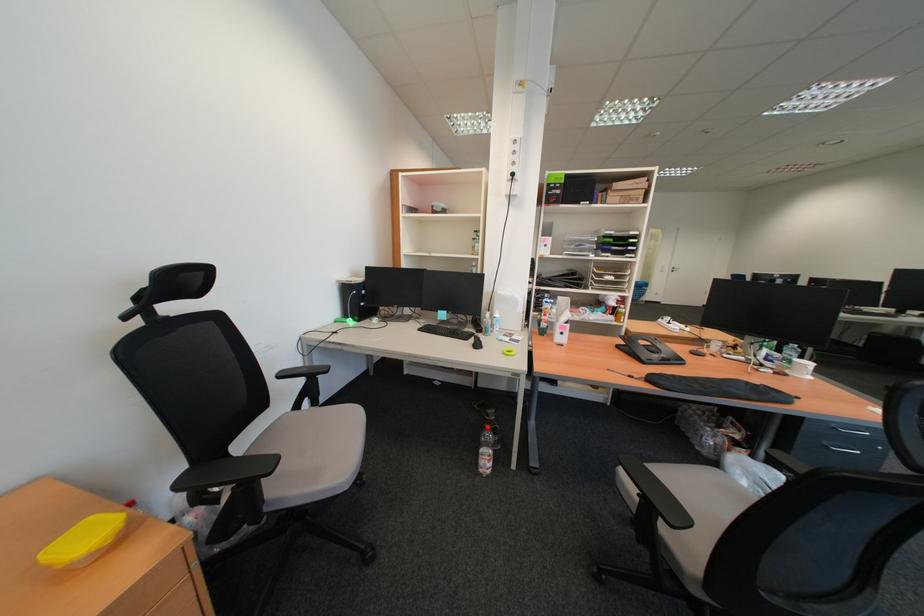
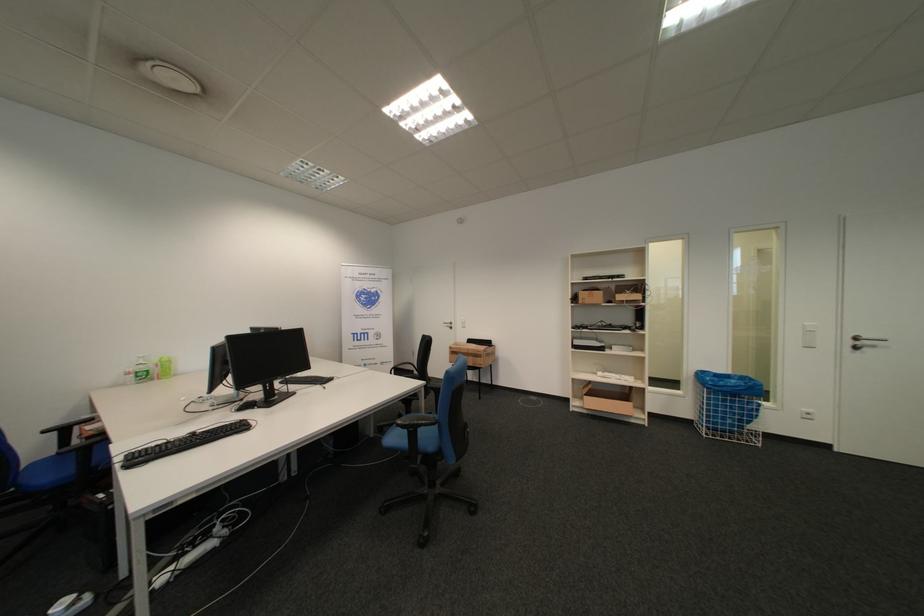
Find the pixel in the second image that matches (649,291) in the first image.

(736, 402)